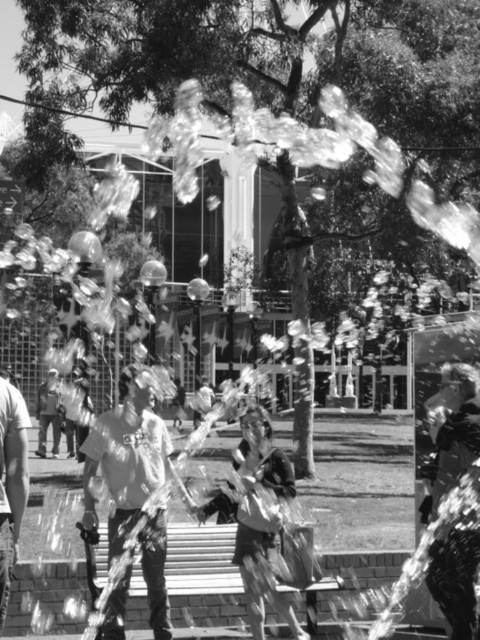
You are a photographer trying to capture a clear shot of both the matte white shirt at center and the matte white shirt at left. Since both are in motion, you want to ensure your focus is sharp. Which of the two should you prioritize focusing on to ensure it appears larger in your photo?

The matte white shirt at center is bigger than the matte white shirt at left, so you should prioritize focusing on the matte white shirt at center to ensure it appears larger in your photo.